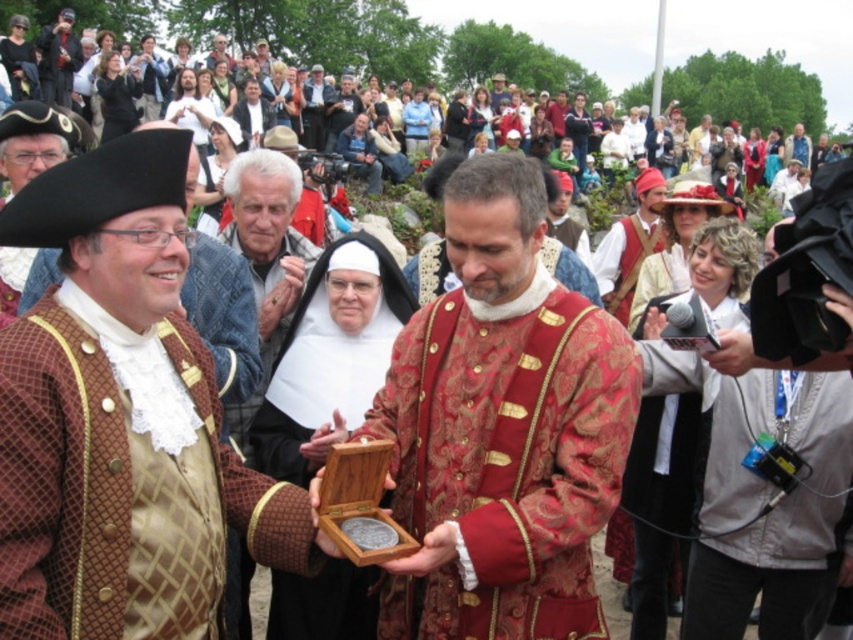
Does point (206, 20) come closer to viewer compared to point (308, 248)?

No, it is not.

Looking at this image, between white clothed nun at center and gray hair man at center, which one is positioned lower?

gray hair man at center

What do you see at coordinates (337, 36) in the screenshot? I see `white clothed nun at center` at bounding box center [337, 36].

At what (x,y) coordinates should I click in order to perform the action: click on white clothed nun at center. Please return your answer as a coordinate pair (x, y). This screenshot has width=853, height=640. Looking at the image, I should click on (337, 36).

Is gray hair man at center to the left of matte black camera at center from the viewer's perspective?

Incorrect, gray hair man at center is not on the left side of matte black camera at center.

Does gray hair man at center come behind matte black camera at center?

No.

Is point (265, 275) less distant than point (306, 124)?

Yes, it is in front of point (306, 124).

This screenshot has height=640, width=853. Identify the location of gray hair man at center. (265, 257).

Between point (410, 497) and point (374, 266), which one is positioned behind?

Positioned behind is point (374, 266).

Is shiny gold brocade coat at center below wooden box at center?

Indeed, shiny gold brocade coat at center is positioned under wooden box at center.

What do you see at coordinates (502, 428) in the screenshot?
I see `shiny gold brocade coat at center` at bounding box center [502, 428].

The image size is (853, 640). I want to click on shiny gold brocade coat at center, so click(502, 428).